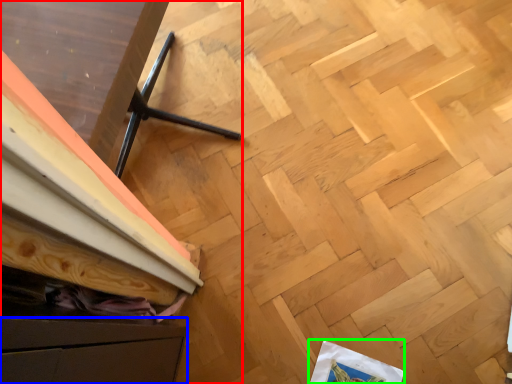
Question: Which object is positioned closest to furniture (highlighted by a red box)? Select from drawer (highlighted by a blue box) and wrapping paper (highlighted by a green box).

Choices:
 (A) drawer
 (B) wrapping paper

Answer: (A)